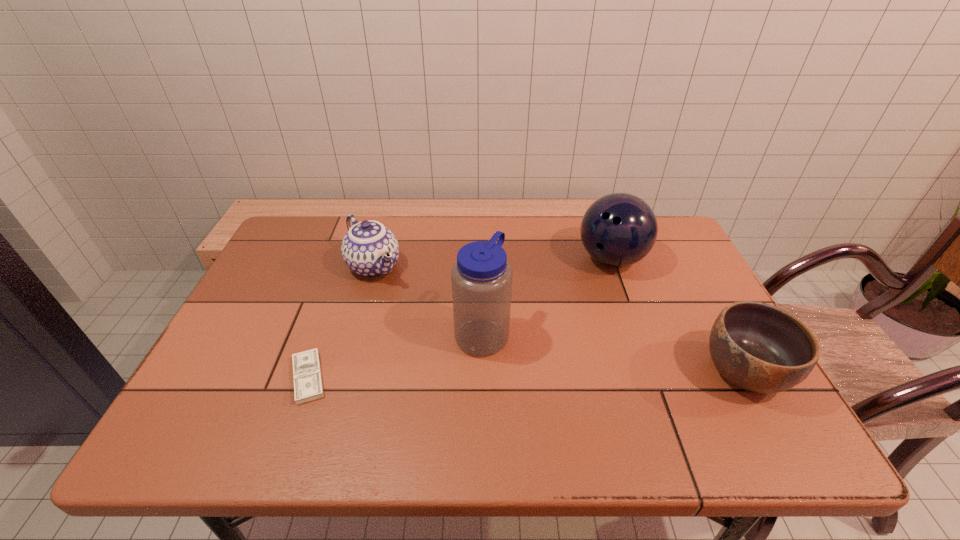
I want to click on vacant space located from the spout of the chinaware, so click(398, 302).

Locate an element on the screen. The width and height of the screenshot is (960, 540). vacant space located from the spout of the chinaware is located at coordinates (400, 304).

Find the location of `free region located 0.150m on the surface of the bowling ball near the finger holes`. free region located 0.150m on the surface of the bowling ball near the finger holes is located at coordinates (592, 315).

Where is `vacant space located on the surface of the bowling ball near the finger holes`? vacant space located on the surface of the bowling ball near the finger holes is located at coordinates (576, 367).

You are a GUI agent. You are given a task and a screenshot of the screen. Output one action in this format:
    pyautogui.click(x=<x>, y=<y>)
    Task: Click on the free region located on the surface of the bowling ball near the finger holes
    The image size is (960, 540).
    Given the screenshot: What is the action you would take?
    pyautogui.click(x=595, y=308)

Where is `vacant space located 0.160m with a carrying loop on the side of the water bottle`? This screenshot has width=960, height=540. vacant space located 0.160m with a carrying loop on the side of the water bottle is located at coordinates (566, 377).

Where is `vacant space situated with a carrying loop on the side of the water bottle`? vacant space situated with a carrying loop on the side of the water bottle is located at coordinates (617, 402).

This screenshot has width=960, height=540. I want to click on vacant region located with a carrying loop on the side of the water bottle, so tap(546, 367).

I want to click on chinaware that is at the far edge, so click(370, 249).

This screenshot has height=540, width=960. In order to click on bowling ball situated at the far edge in this screenshot , I will do `click(619, 229)`.